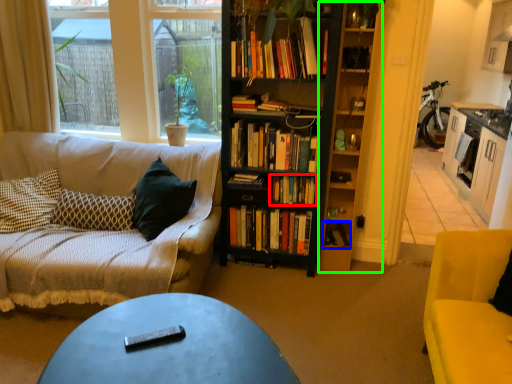
Question: Estimate the real-world distances between objects in this image. Which object is farther from book (highlighted by a red box), book (highlighted by a blue box) or shelf (highlighted by a green box)?

Choices:
 (A) book
 (B) shelf

Answer: (A)